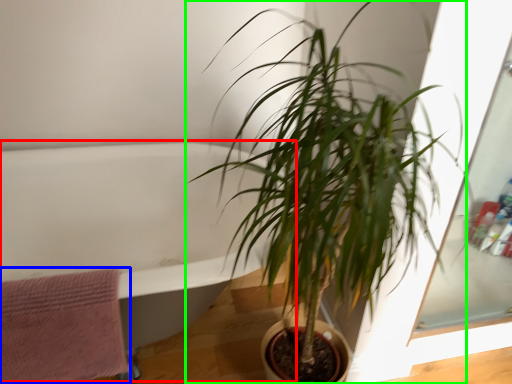
Question: Considering the real-world distances, which object is closest to bath (highlighted by a red box)? bath towel (highlighted by a blue box) or houseplant (highlighted by a green box).

Choices:
 (A) bath towel
 (B) houseplant

Answer: (A)